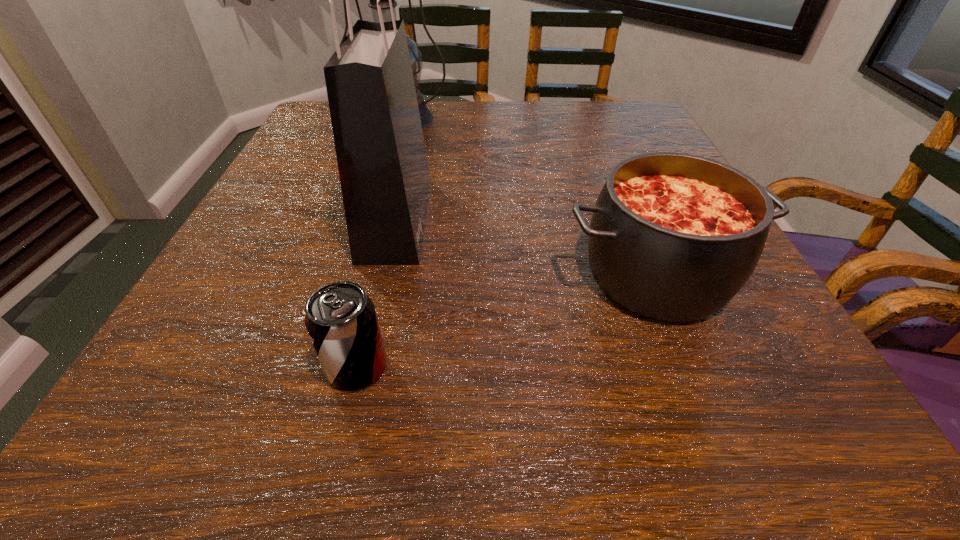
Locate an element on the screen. The height and width of the screenshot is (540, 960). free area in between the shopping bag and the soda can is located at coordinates (376, 293).

At what (x,y) coordinates should I click in order to perform the action: click on free space between the second shortest object and the shortest object. Please return your answer as a coordinate pair (x, y). This screenshot has height=540, width=960. Looking at the image, I should click on (507, 321).

Locate an element on the screen. This screenshot has height=540, width=960. empty space between the rightmost object and the farthest object is located at coordinates (527, 197).

The image size is (960, 540). Identify the location of unoccupied area between the rightmost object and the soda can. (507, 321).

Where is `free space between the shopping bag and the casserole`? free space between the shopping bag and the casserole is located at coordinates (526, 247).

I want to click on vacant point located between the soda can and the shopping bag, so click(376, 293).

You are a GUI agent. You are given a task and a screenshot of the screen. Output one action in this format:
    pyautogui.click(x=<x>, y=<y>)
    Task: Click on the unoccupied area between the oil lamp and the casserole
    
    Given the screenshot: What is the action you would take?
    (x=527, y=197)

Locate an element on the screen. empty space that is in between the casserole and the soda can is located at coordinates (507, 321).

Where is `object that is the third nearest to the shopping bag`? object that is the third nearest to the shopping bag is located at coordinates (673, 236).

Where is `the second closest object to the shopping bag`? the second closest object to the shopping bag is located at coordinates (426, 116).